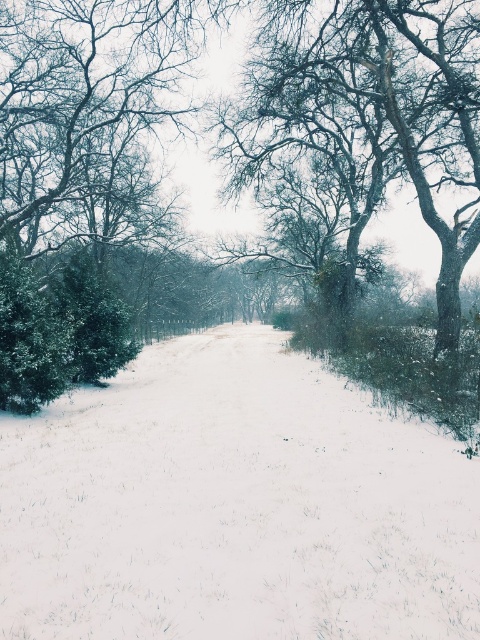
Consider the image. You are standing in the winter scene described. You see a point labeled as point (233, 506). What is located at that point?

The point (233, 506) corresponds to white snow at center.